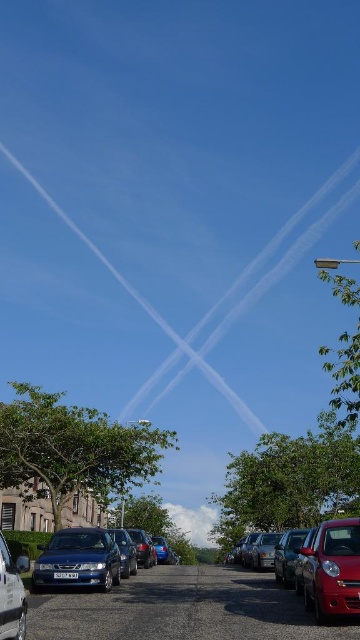
You are a photographer trying to capture both the shiny red car at lower right and the metallic silver car at center in a single frame. Given their sizes, which car will appear bigger in your photo?

The shiny red car at lower right will appear bigger in the photo because it is larger in size than the metallic silver car at center.

You are a delivery driver who needs to park your truck, which is 2 meters wide, in the space between the matte red car at lower right and the metallic silver car at lower left. Based on the scene, can you fit your truck there?

The matte red car at lower right might be wider than metallic silver car at lower left, but without exact measurements, it is uncertain if the space between them is wide enough for a 2 meter wide truck. Proceed with caution or check the available space physically.